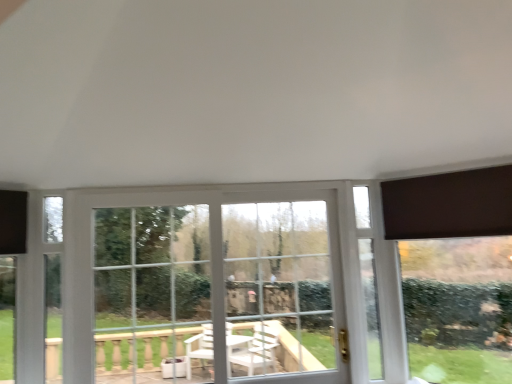
Question: Could you tell me if white plastic window at center is turned towards clear glass bay window at center?

Choices:
 (A) no
 (B) yes

Answer: (B)

Question: Is white plastic window at center in contact with clear glass bay window at center?

Choices:
 (A) no
 (B) yes

Answer: (A)

Question: Is white plastic window at center far away from clear glass bay window at center?

Choices:
 (A) no
 (B) yes

Answer: (A)

Question: From a real-world perspective, is white plastic window at center on top of clear glass bay window at center?

Choices:
 (A) yes
 (B) no

Answer: (B)

Question: Can you confirm if white plastic window at center is positioned to the left of clear glass bay window at center?

Choices:
 (A) no
 (B) yes

Answer: (A)

Question: Considering the relative sizes of white plastic window at center and clear glass bay window at center in the image provided, is white plastic window at center bigger than clear glass bay window at center?

Choices:
 (A) yes
 (B) no

Answer: (B)

Question: Would you consider clear glass bay window at center to be distant from white plastic window at center?

Choices:
 (A) no
 (B) yes

Answer: (A)

Question: Does clear glass bay window at center have a lesser width compared to white plastic window at center?

Choices:
 (A) no
 (B) yes

Answer: (B)

Question: Considering the relative positions of clear glass bay window at center and white plastic window at center in the image provided, is clear glass bay window at center behind white plastic window at center?

Choices:
 (A) no
 (B) yes

Answer: (A)

Question: Is clear glass bay window at center to the left of white plastic window at center from the viewer's perspective?

Choices:
 (A) yes
 (B) no

Answer: (A)

Question: From the image's perspective, is clear glass bay window at center below white plastic window at center?

Choices:
 (A) no
 (B) yes

Answer: (A)

Question: Is clear glass bay window at center bigger than white plastic window at center?

Choices:
 (A) yes
 (B) no

Answer: (A)

Question: Is clear glass bay window at center positioned with its back to dark brown fabric at upper right?

Choices:
 (A) yes
 (B) no

Answer: (B)